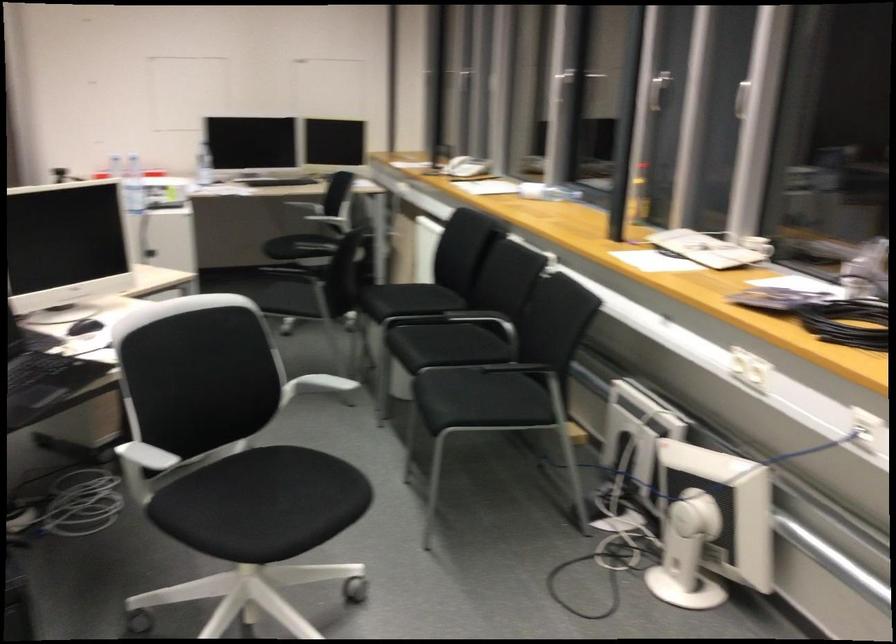
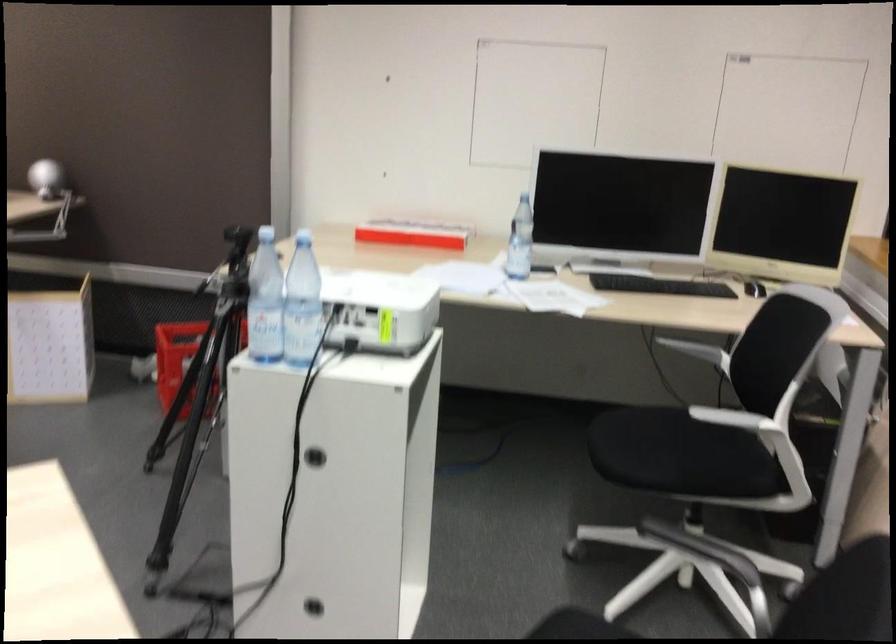
Question: The images are taken continuously from a first-person perspective. In which direction are you moving?

Choices:
 (A) Left
 (B) Right
 (C) Forward
 (D) Backward

Answer: (C)